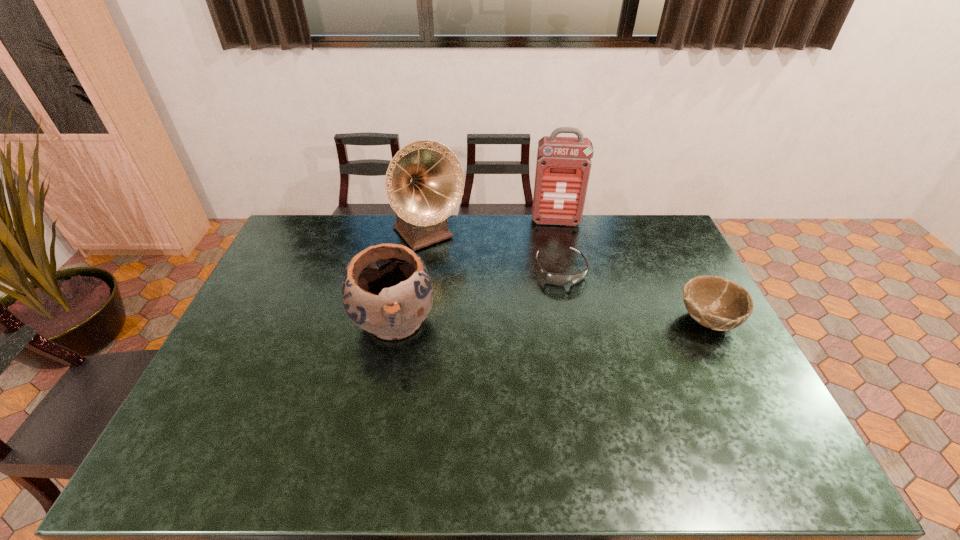
This screenshot has width=960, height=540. Identify the location of vacant area that lies between the fourth tallest object and the first-aid kit. (632, 271).

Find the location of a particular element. blank region between the first-aid kit and the bowl is located at coordinates (632, 271).

Identify which object is the second closest to the first-aid kit. Please provide its 2D coordinates. Your answer should be formatted as a tuple, i.e. [(x, y)], where the tuple contains the x and y coordinates of a point satisfying the conditions above.

[(424, 183)]

Identify the location of object that is the closest to the goggles. The image size is (960, 540). (563, 165).

You are a GUI agent. You are given a task and a screenshot of the screen. Output one action in this format:
    pyautogui.click(x=<x>, y=<y>)
    Task: Click on the free space that satisfies the following two spatial constraints: 1. on the back side of the pottery; 2. on the left side of the goggles
    
    Given the screenshot: What is the action you would take?
    pyautogui.click(x=404, y=269)

At what (x,y) coordinates should I click in order to perform the action: click on blank area in the image that satisfies the following two spatial constraints: 1. on the front side of the bowl; 2. on the right side of the first-aid kit. Please return your answer as a coordinate pair (x, y). Looking at the image, I should click on (578, 320).

Identify the location of free region that satisfies the following two spatial constraints: 1. on the front side of the rightmost object; 2. on the right side of the phonograph record. (416, 320).